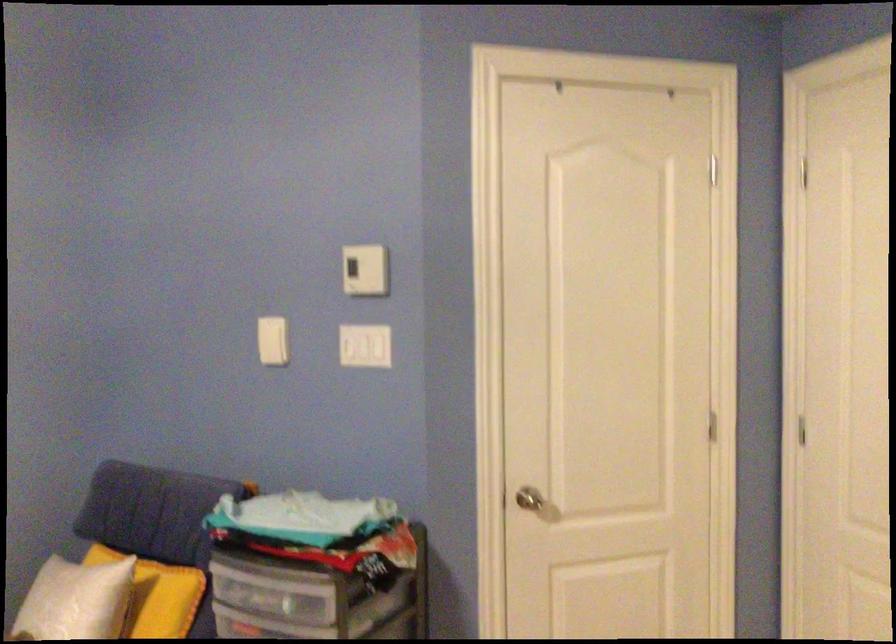
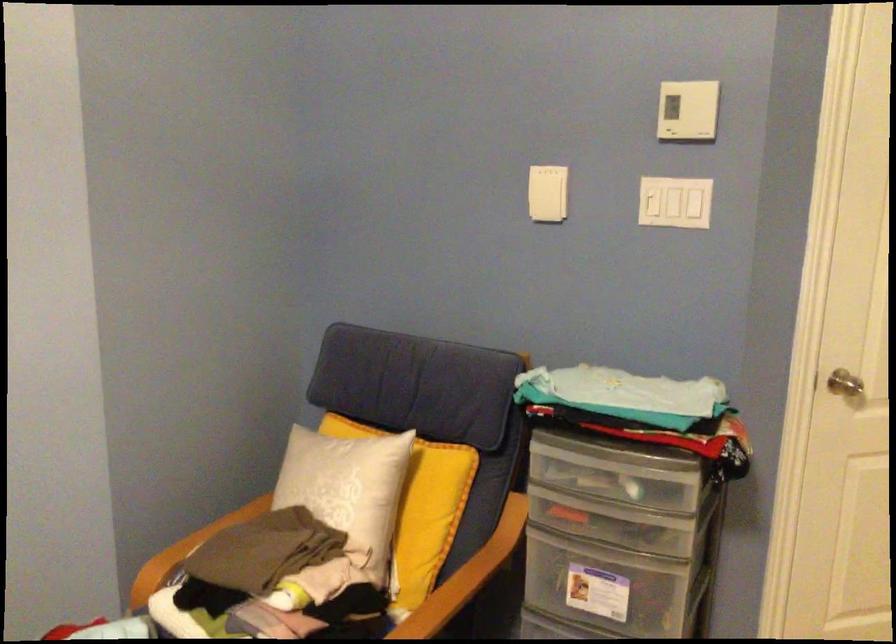
In a continuous first-person perspective shot, in which direction is the camera moving?

The cameraman walked toward left, forward.